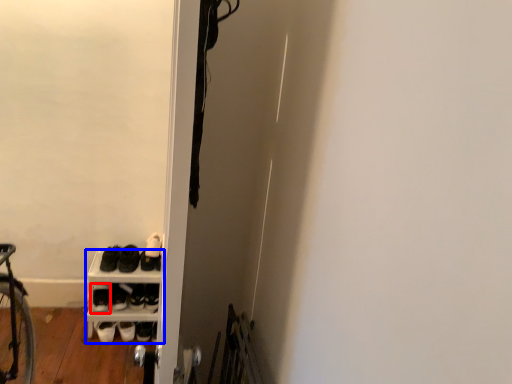
Question: Which object is further to the camera taking this photo, footwear (highlighted by a red box) or shelf (highlighted by a blue box)?

Choices:
 (A) footwear
 (B) shelf

Answer: (A)